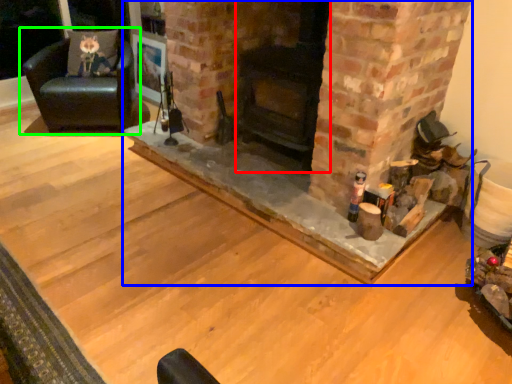
Question: Which is nearer to the fireplace (highlighted by a red box)? fireplace (highlighted by a blue box) or chair (highlighted by a green box).

Choices:
 (A) fireplace
 (B) chair

Answer: (A)